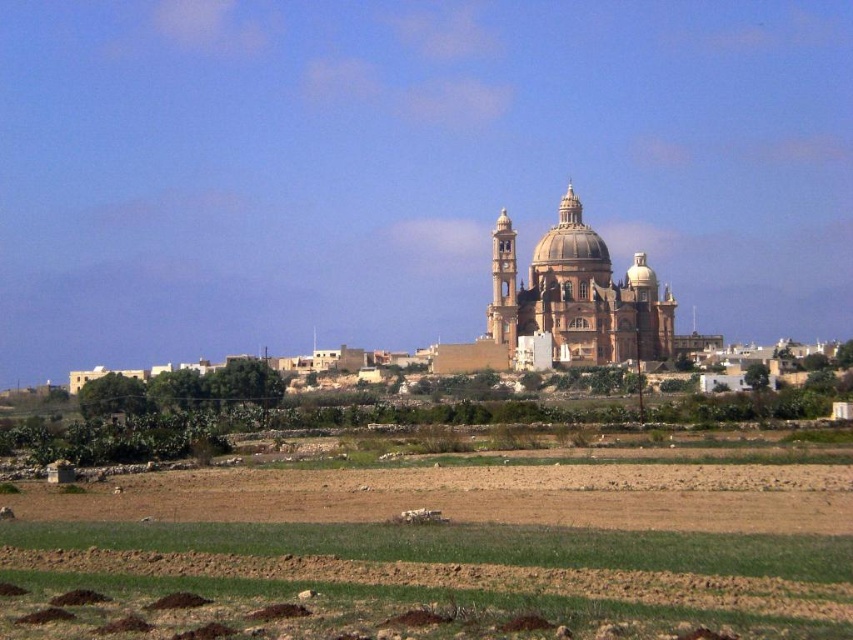
Question: Can you confirm if brown soil field at lower center is positioned above brown stone church at center?

Choices:
 (A) yes
 (B) no

Answer: (B)

Question: Which object is closer to the camera taking this photo?

Choices:
 (A) brown soil field at lower center
 (B) brown stone church at center

Answer: (A)

Question: Can you confirm if brown soil field at lower center is thinner than brown stone church at center?

Choices:
 (A) no
 (B) yes

Answer: (A)

Question: Which point appears farthest from the camera in this image?

Choices:
 (A) (548, 234)
 (B) (15, 627)

Answer: (A)

Question: Does brown soil field at lower center come in front of brown stone church at center?

Choices:
 (A) no
 (B) yes

Answer: (B)